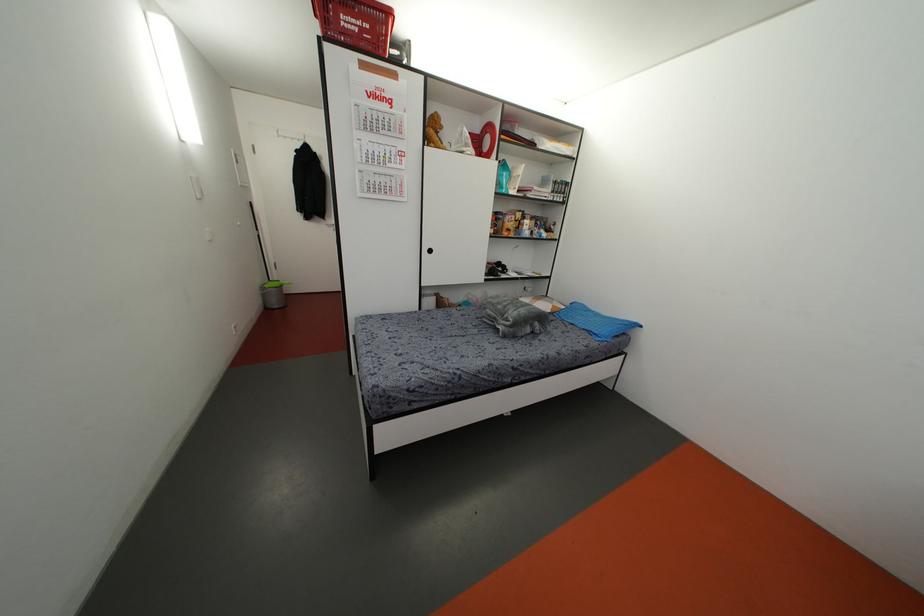
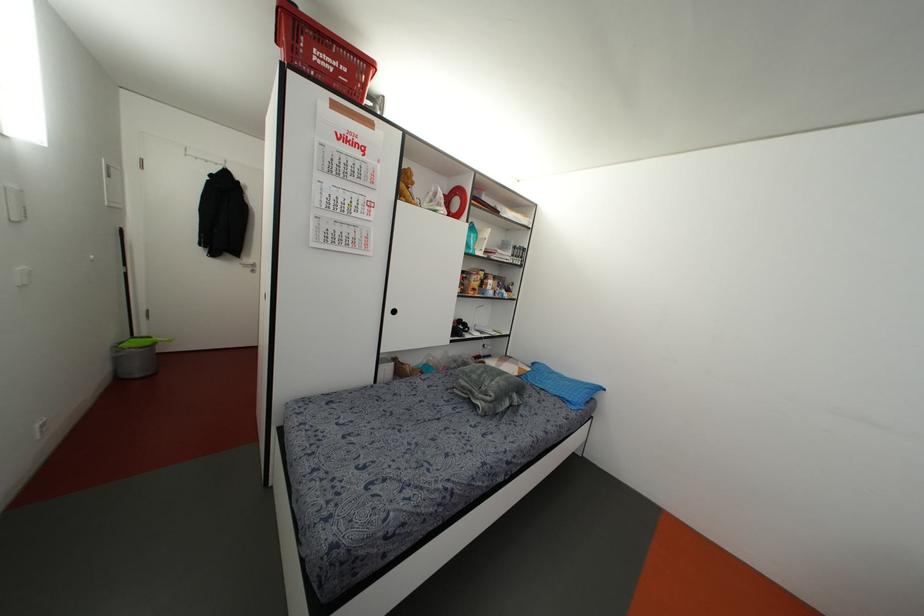
Find the pixel in the second image that matches the point at 479,153 in the first image.

(448, 213)